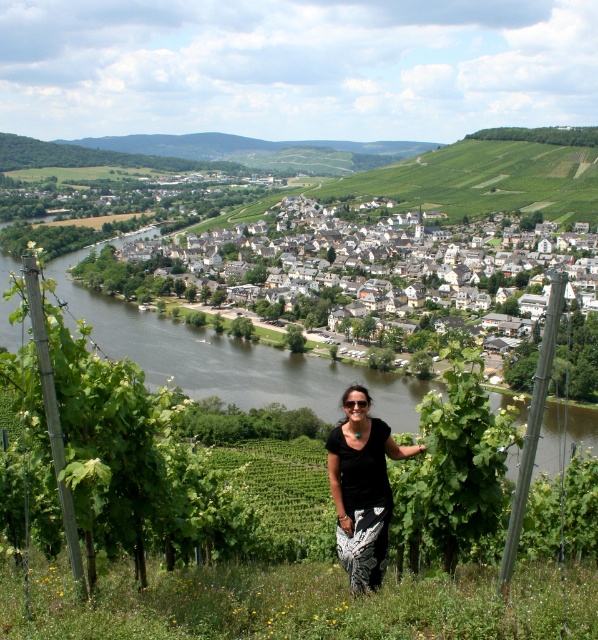
You are a tourist standing in the vineyard and looking at the green grassy hillside at upper center and the black cotton top at center. Which object is closer to you?

The green grassy hillside at upper center is closer to you than the black cotton top at center because it is further to the viewer.

From the picture: You are a tourist standing at the edge of the vineyards and looking towards the town. Which object, the white stone houses at center or the green grassy hillside at upper center, is positioned higher in the scene?

The green grassy hillside at upper center is positioned higher than the white stone houses at center because the white stone houses at center is located below it.